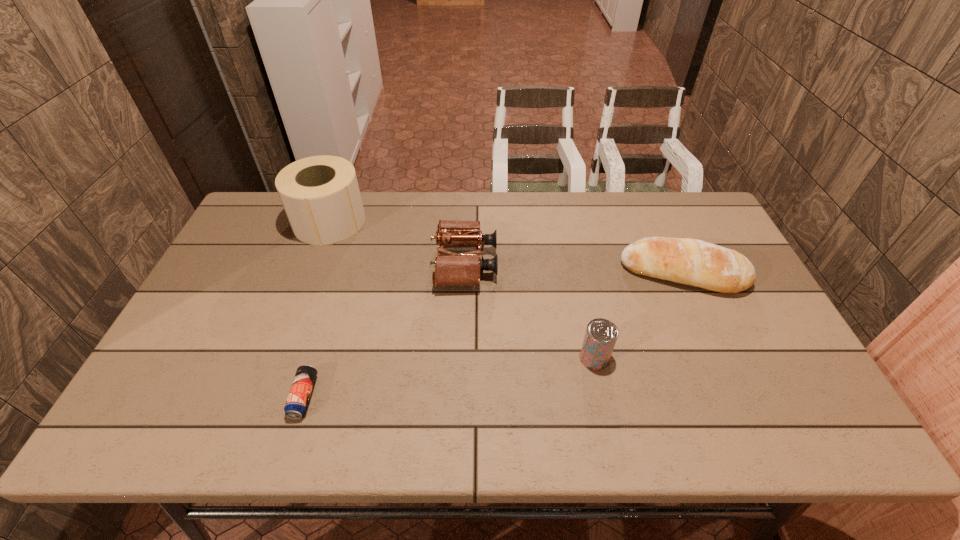
The width and height of the screenshot is (960, 540). In order to click on free space located 0.200m on the left of the farther beer can in this screenshot , I will do `click(499, 358)`.

Where is `vacant space located 0.050m on the front of the nearest object`? vacant space located 0.050m on the front of the nearest object is located at coordinates (290, 442).

At what (x,y) coordinates should I click in order to perform the action: click on object that is at the far edge. Please return your answer as a coordinate pair (x, y). Image resolution: width=960 pixels, height=540 pixels. Looking at the image, I should click on (320, 194).

The image size is (960, 540). What are the coordinates of `object positioned at the near edge` in the screenshot? It's located at (296, 405).

You are a GUI agent. You are given a task and a screenshot of the screen. Output one action in this format:
    pyautogui.click(x=<x>, y=<y>)
    Task: Click on the object positioned at the left edge
    This screenshot has width=960, height=540.
    Given the screenshot: What is the action you would take?
    pyautogui.click(x=320, y=194)

Where is `object at the right edge`? object at the right edge is located at coordinates (694, 262).

Find the location of `object present at the far left corner`. object present at the far left corner is located at coordinates (320, 194).

The height and width of the screenshot is (540, 960). I want to click on free space at the far edge of the desktop, so click(x=622, y=192).

Identify the location of vacant space at the near edge of the desktop. This screenshot has height=540, width=960. (600, 410).

At what (x,y) coordinates should I click in order to perform the action: click on vacant position at the left edge of the desktop. Please return your answer as a coordinate pair (x, y). Image resolution: width=960 pixels, height=540 pixels. Looking at the image, I should click on pos(181,348).